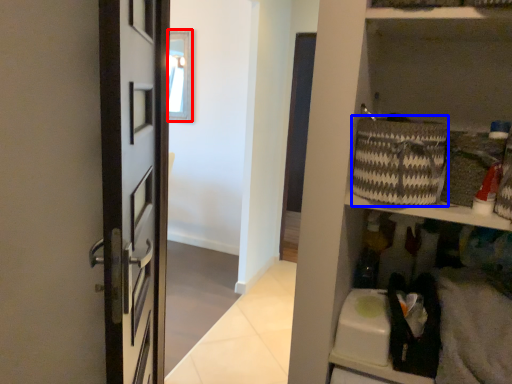
Question: Which object appears closest to the camera in this image, window (highlighted by a red box) or basket (highlighted by a blue box)?

Choices:
 (A) window
 (B) basket

Answer: (B)